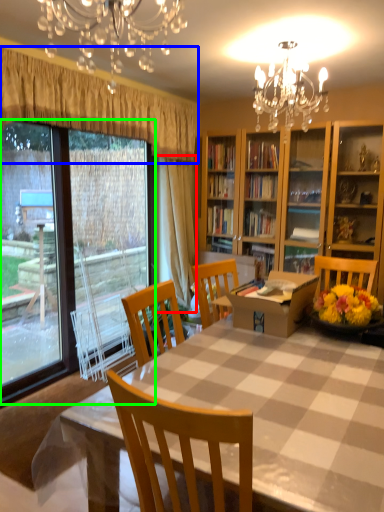
Question: Which object is the farthest from curtain (highlighted by a red box)? Choose among these: curtain (highlighted by a blue box) or bay window (highlighted by a green box).

Choices:
 (A) curtain
 (B) bay window

Answer: (B)